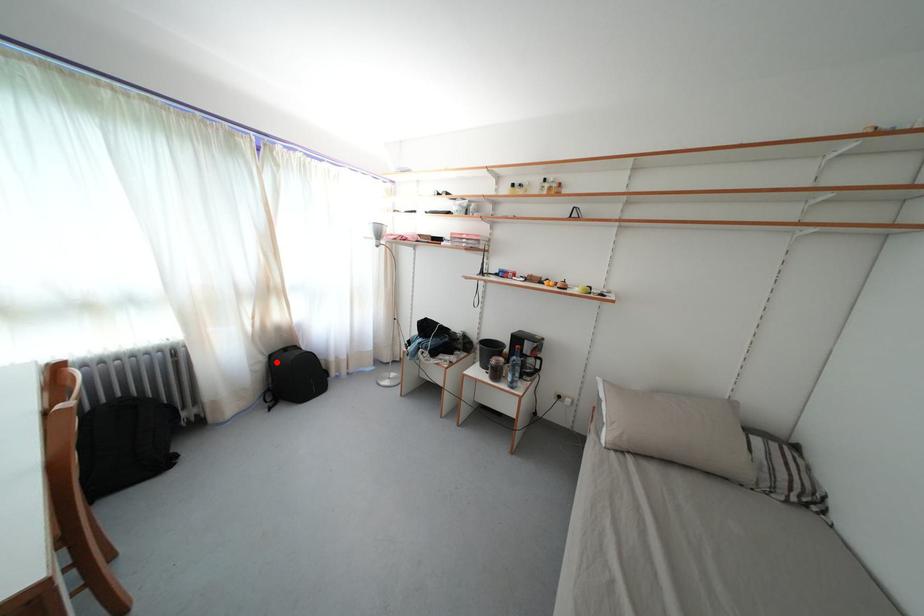
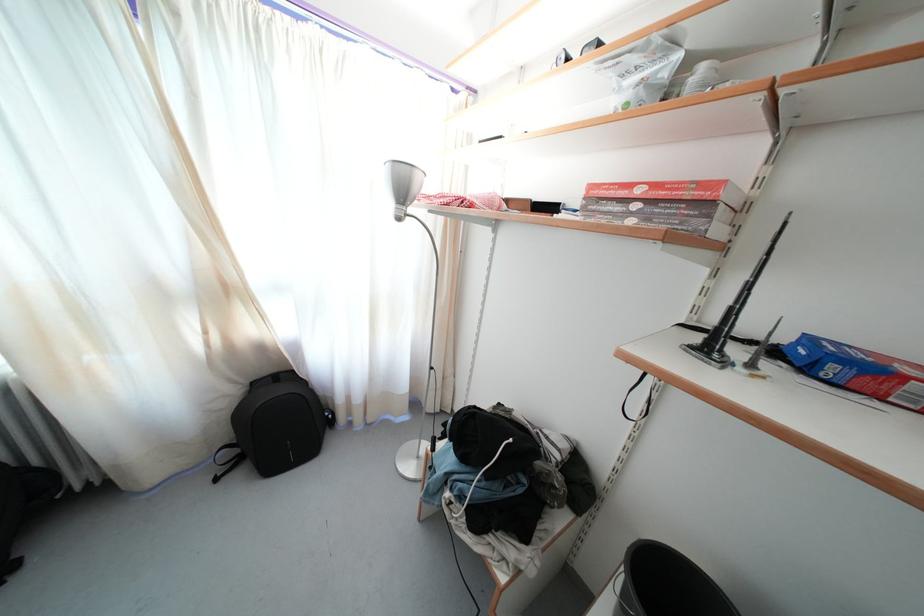
Where in the second image is the point corresponding to the highlighted location from the first image?

(259, 390)